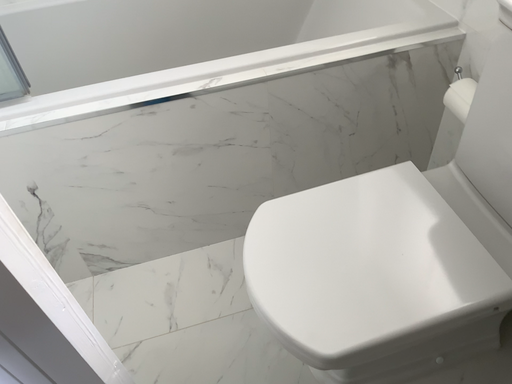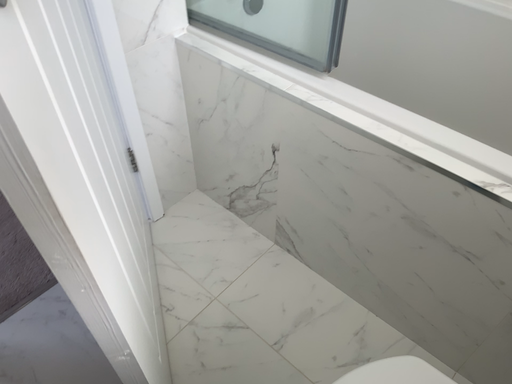
Question: How did the camera likely rotate when shooting the video?

Choices:
 (A) rotated right
 (B) rotated left

Answer: (B)